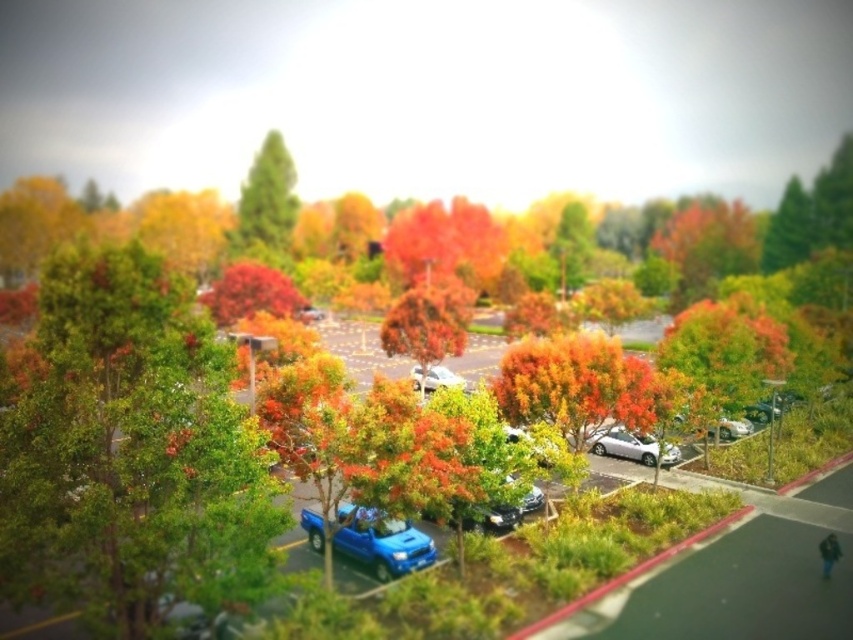
Between shiny blue pickup truck at center and shiny metallic car at center, which one is positioned higher?

shiny blue pickup truck at center is higher up.

Is shiny blue pickup truck at center smaller than shiny metallic car at center?

Actually, shiny blue pickup truck at center might be larger than shiny metallic car at center.

The height and width of the screenshot is (640, 853). Find the location of `shiny blue pickup truck at center`. shiny blue pickup truck at center is located at coordinates (381, 541).

Between point (399, 323) and point (442, 380), which one is positioned behind?

The point (442, 380) is behind.

Measure the distance between orange matte tree at center and satin silver sedan at center.

orange matte tree at center is 2.59 meters away from satin silver sedan at center.

I want to click on orange matte tree at center, so click(x=428, y=330).

Does orange matte tree at center have a lesser width compared to silver metallic car at center-right?

No.

Which is more to the left, orange matte tree at center or silver metallic car at center-right?

From the viewer's perspective, orange matte tree at center appears more on the left side.

Between point (428, 291) and point (607, 428), which one is positioned in front?

Point (607, 428) is more forward.

Where is `orange matte tree at center`? The image size is (853, 640). orange matte tree at center is located at coordinates (428, 330).